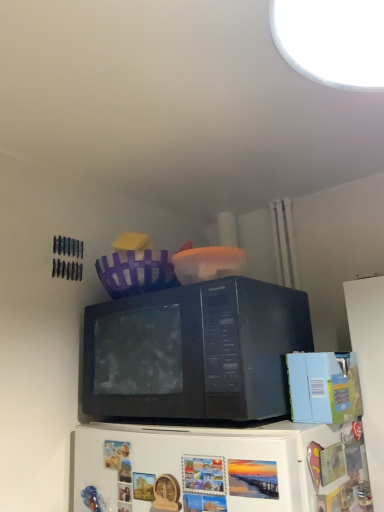
This screenshot has height=512, width=384. What do you see at coordinates (194, 352) in the screenshot? I see `black matte microwave at center` at bounding box center [194, 352].

Looking at this image, measure the distance between black matte microwave at center and camera.

black matte microwave at center and camera are 32.54 inches apart from each other.

I want to click on black matte microwave at center, so click(194, 352).

Where is `black matte microwave at center`? This screenshot has width=384, height=512. black matte microwave at center is located at coordinates (194, 352).